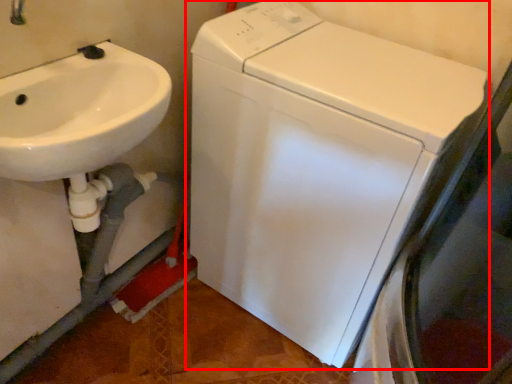
Question: Where is washing machine (annotated by the red box) located in relation to sink in the image?

Choices:
 (A) right
 (B) left

Answer: (A)